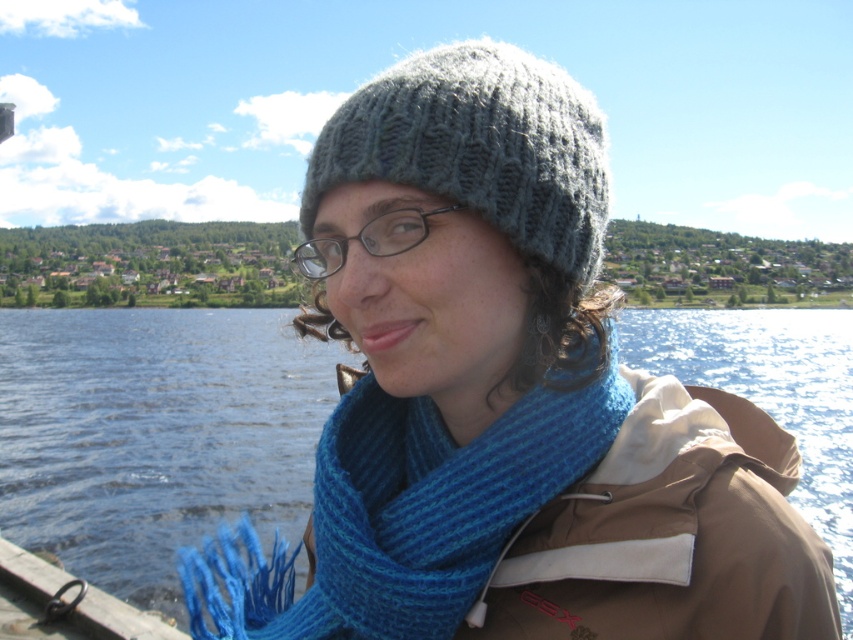
Between blue knitted scarf at center and knitted gray hat at center, which one has more height?

Standing taller between the two is knitted gray hat at center.

Which is in front, point (483, 545) or point (459, 108)?

Point (459, 108) is more forward.

Between point (483, 515) and point (469, 205), which one is positioned in front?

Positioned in front is point (469, 205).

At what (x,y) coordinates should I click in order to perform the action: click on blue knitted scarf at center. Please return your answer as a coordinate pair (x, y). Image resolution: width=853 pixels, height=640 pixels. Looking at the image, I should click on (410, 509).

Who is lower down, knitted woolen hat at center or knitted gray hat at center?

knitted woolen hat at center

Does knitted woolen hat at center appear under knitted gray hat at center?

Correct, knitted woolen hat at center is located below knitted gray hat at center.

Locate an element on the screen. Image resolution: width=853 pixels, height=640 pixels. knitted woolen hat at center is located at coordinates (505, 401).

From the picture: Which of these two, knitted woolen hat at center or blue knitted scarf at center, stands shorter?

With less height is blue knitted scarf at center.

Does point (328, 618) come farther from viewer compared to point (370, 531)?

Yes.

Which is behind, point (416, 470) or point (560, 400)?

The point (416, 470) is behind.

The width and height of the screenshot is (853, 640). I want to click on knitted woolen hat at center, so click(x=505, y=401).